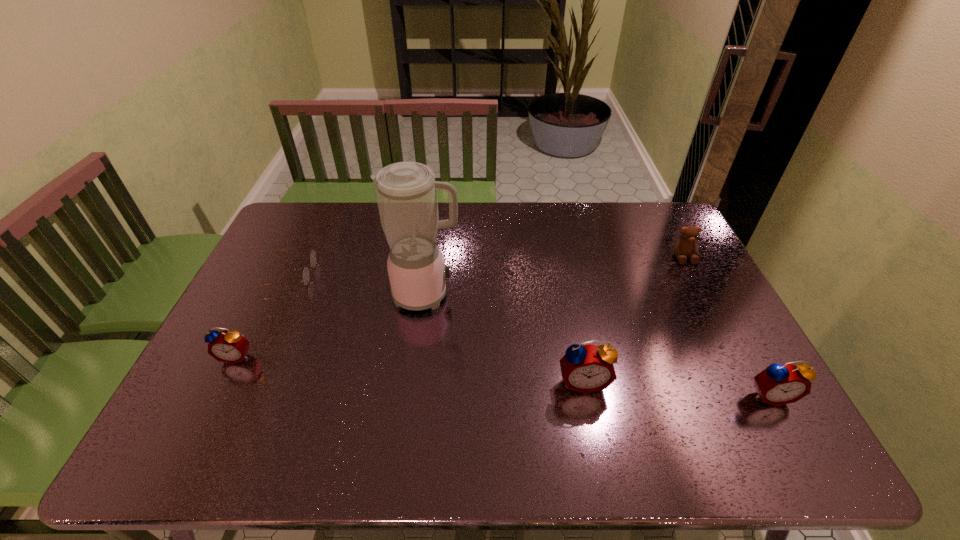
Where is `free point located on the front-facing side of the third object from right to left`? The height and width of the screenshot is (540, 960). free point located on the front-facing side of the third object from right to left is located at coordinates (590, 417).

The image size is (960, 540). I want to click on vacant space located on the base of the tallest object near the control knob, so click(x=504, y=294).

This screenshot has width=960, height=540. In order to click on free space located 0.370m on the face of the teddy bear in this screenshot , I will do `click(735, 357)`.

Locate an element on the screen. The width and height of the screenshot is (960, 540). free spot located 0.400m on the temples of the shortest object is located at coordinates (441, 274).

You are a GUI agent. You are given a task and a screenshot of the screen. Output one action in this format:
    pyautogui.click(x=<x>, y=<y>)
    Task: Click on the alarm clock that is positioned at the left edge
    This screenshot has width=960, height=540.
    Given the screenshot: What is the action you would take?
    pyautogui.click(x=231, y=347)

This screenshot has height=540, width=960. In order to click on spectacles located at the left edge in this screenshot , I will do `click(313, 257)`.

Find the location of a particular element. The image size is (960, 540). alarm clock that is at the right edge is located at coordinates (778, 384).

Identify the location of teddy bear located in the right edge section of the desktop. (686, 245).

Find the location of a particular element. object present at the near right corner is located at coordinates (778, 384).

Locate an element on the screen. The image size is (960, 540). vacant point at the far edge is located at coordinates (569, 202).